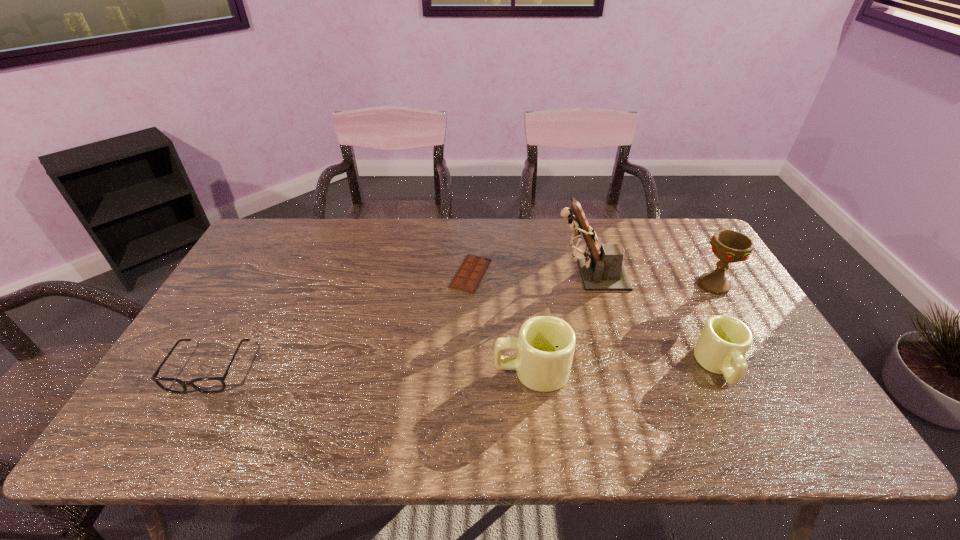
Identify the location of figurine located at the far edge. This screenshot has height=540, width=960. (602, 269).

Where is `spectacles that is at the near edge`? The width and height of the screenshot is (960, 540). spectacles that is at the near edge is located at coordinates (209, 385).

Find the location of a particular element. object that is at the left edge is located at coordinates (209, 385).

The height and width of the screenshot is (540, 960). I want to click on mug that is positioned at the right edge, so click(724, 341).

Where is `chalice that is at the right edge`? chalice that is at the right edge is located at coordinates (729, 246).

At what (x,y) coordinates should I click in order to perform the action: click on object situated at the near left corner. Please return your answer as a coordinate pair (x, y). This screenshot has width=960, height=540. Looking at the image, I should click on (209, 385).

Find the location of `object located in the near right corner section of the desktop`. object located in the near right corner section of the desktop is located at coordinates (724, 341).

Image resolution: width=960 pixels, height=540 pixels. What are the coordinates of `vacant point at the far edge` in the screenshot? It's located at (409, 238).

The width and height of the screenshot is (960, 540). Find the location of `vacant space at the near edge of the desktop`. vacant space at the near edge of the desktop is located at coordinates (x=727, y=396).

In order to click on free space at the left edge of the desktop in this screenshot , I will do `click(250, 318)`.